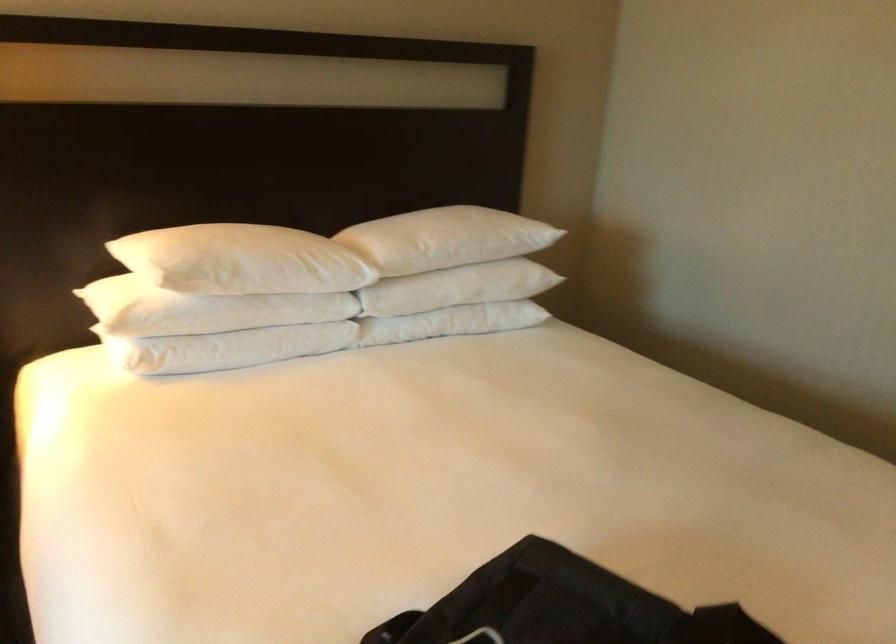
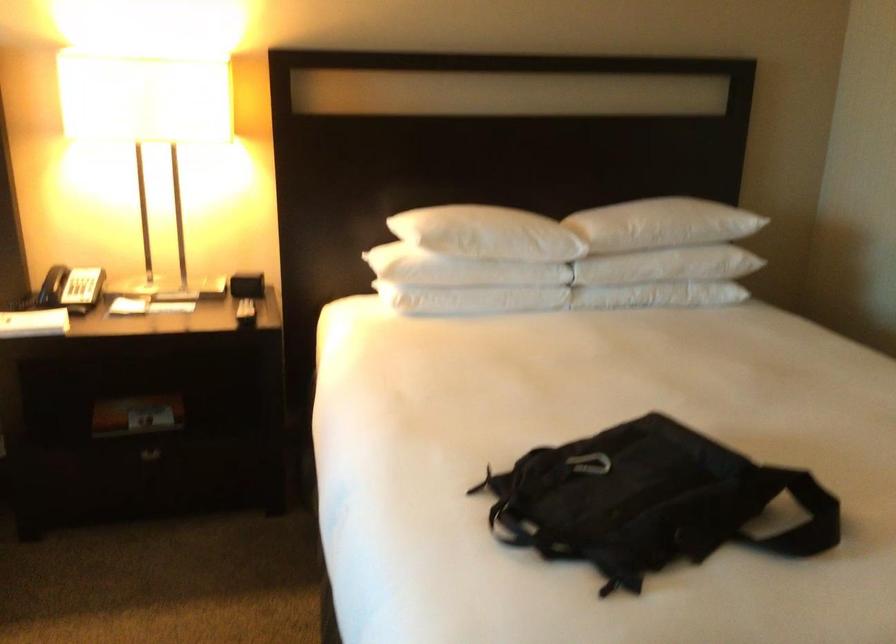
Locate, in the second image, the point that corresponds to point (349, 245) in the first image.

(571, 223)